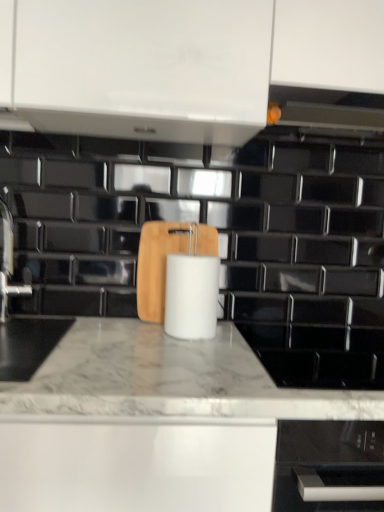
Question: From the image's perspective, is wooden cutting board at center beneath white marble countertop at center?

Choices:
 (A) yes
 (B) no

Answer: (B)

Question: From the image's perspective, would you say wooden cutting board at center is positioned over white marble countertop at center?

Choices:
 (A) yes
 (B) no

Answer: (A)

Question: Considering the relative positions of wooden cutting board at center and white marble countertop at center in the image provided, is wooden cutting board at center to the right of white marble countertop at center from the viewer's perspective?

Choices:
 (A) yes
 (B) no

Answer: (B)

Question: Considering the relative sizes of wooden cutting board at center and white marble countertop at center in the image provided, is wooden cutting board at center bigger than white marble countertop at center?

Choices:
 (A) yes
 (B) no

Answer: (B)

Question: Is wooden cutting board at center not near white marble countertop at center?

Choices:
 (A) yes
 (B) no

Answer: (B)

Question: Looking at the image, does satin nickel faucet at left seem bigger or smaller compared to wooden cutting board at center?

Choices:
 (A) big
 (B) small

Answer: (B)

Question: Is point (6, 245) positioned closer to the camera than point (158, 274)?

Choices:
 (A) closer
 (B) farther

Answer: (B)

Question: From the image's perspective, relative to wooden cutting board at center, is satin nickel faucet at left above or below?

Choices:
 (A) below
 (B) above

Answer: (B)

Question: From a real-world perspective, is satin nickel faucet at left above or below wooden cutting board at center?

Choices:
 (A) above
 (B) below

Answer: (A)

Question: Relative to white matte paper towel at center, is white marble countertop at center in front or behind?

Choices:
 (A) front
 (B) behind

Answer: (A)

Question: Is point (167, 506) positioned closer to the camera than point (185, 329)?

Choices:
 (A) closer
 (B) farther

Answer: (A)

Question: From a real-world perspective, is white marble countertop at center positioned above or below white matte paper towel at center?

Choices:
 (A) below
 (B) above

Answer: (A)

Question: Is white marble countertop at center wider or thinner than white matte paper towel at center?

Choices:
 (A) thin
 (B) wide

Answer: (B)

Question: Based on their positions, is wooden cutting board at center located to the left or right of satin nickel faucet at left?

Choices:
 (A) left
 (B) right

Answer: (B)

Question: From the image's perspective, is wooden cutting board at center located above or below satin nickel faucet at left?

Choices:
 (A) below
 (B) above

Answer: (A)